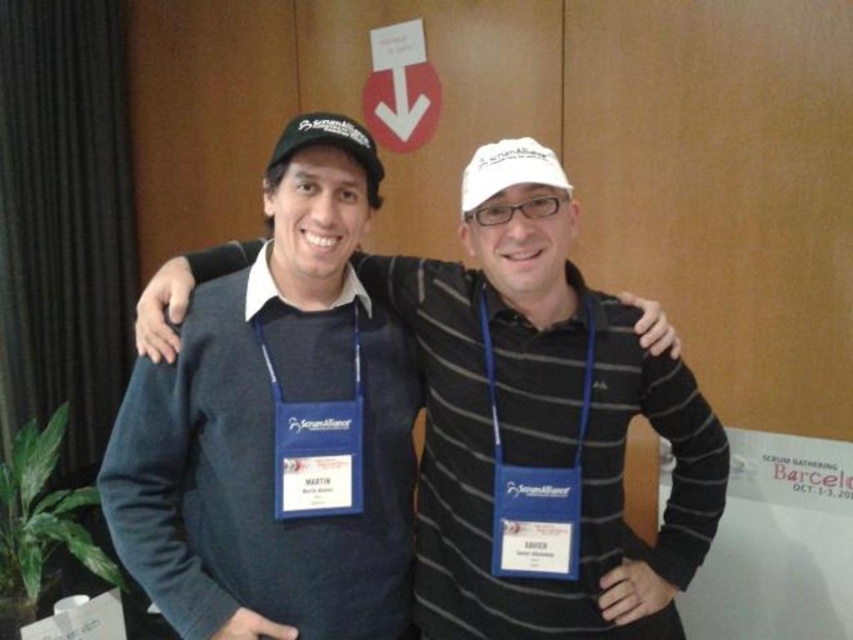
What do you see at coordinates (541, 428) in the screenshot? I see `dark blue sweater at center` at bounding box center [541, 428].

Between dark blue sweater at center and white matte baseball cap at center, which one appears on the left side from the viewer's perspective?

From the viewer's perspective, dark blue sweater at center appears more on the left side.

Locate an element on the screen. dark blue sweater at center is located at coordinates (541, 428).

Does point (550, 172) lie in front of point (293, 145)?

No, (550, 172) is further to viewer.

Between white matte baseball cap at center and black matte baseball cap at upper center, which one appears on the left side from the viewer's perspective?

black matte baseball cap at upper center is more to the left.

Is point (498, 141) more distant than point (292, 125)?

Yes, point (498, 141) is behind point (292, 125).

You are a GUI agent. You are given a task and a screenshot of the screen. Output one action in this format:
    pyautogui.click(x=<x>, y=<y>)
    Task: Click on the white matte baseball cap at center
    The height and width of the screenshot is (640, 853).
    Given the screenshot: What is the action you would take?
    pyautogui.click(x=508, y=170)

The width and height of the screenshot is (853, 640). What do you see at coordinates (541, 428) in the screenshot?
I see `dark blue sweater at center` at bounding box center [541, 428].

Who is more distant from viewer, [606,460] or [289,148]?

Point [606,460]

Describe the element at coordinates (541, 428) in the screenshot. I see `dark blue sweater at center` at that location.

This screenshot has width=853, height=640. In order to click on dark blue sweater at center in this screenshot , I will do `click(541, 428)`.